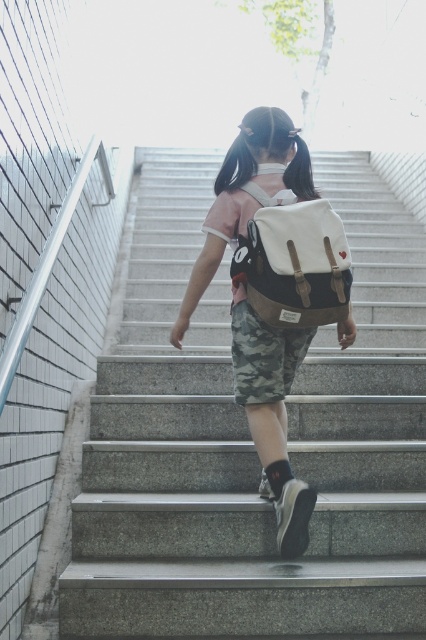
Question: Estimate the real-world distances between objects in this image. Which object is farther from the camouflage shorts at center?

Choices:
 (A) canvas/leather backpack at center
 (B) camo fabric shorts at center
 (C) gray concrete stairs at center

Answer: (C)

Question: Is gray concrete stairs at center below camo fabric shorts at center?

Choices:
 (A) no
 (B) yes

Answer: (B)

Question: Which point is closer to the camera?

Choices:
 (A) gray concrete stairs at center
 (B) camouflage shorts at center

Answer: (A)

Question: Is camouflage shorts at center smaller than canvas/leather backpack at center?

Choices:
 (A) no
 (B) yes

Answer: (A)

Question: Does gray concrete stairs at center appear over camouflage shorts at center?

Choices:
 (A) yes
 (B) no

Answer: (B)

Question: Which object appears farthest from the camera in this image?

Choices:
 (A) canvas/leather backpack at center
 (B) gray concrete stairs at center
 (C) camouflage shorts at center

Answer: (C)